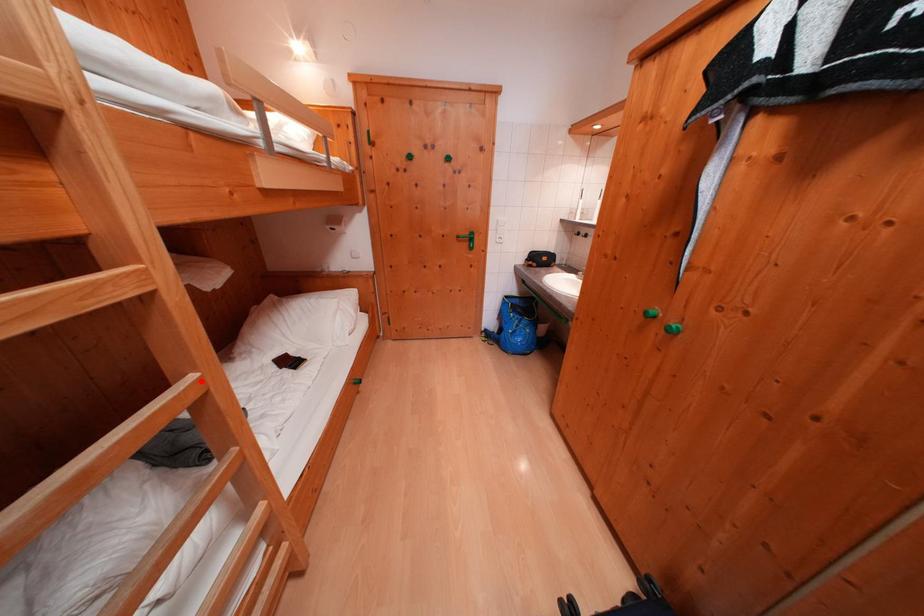
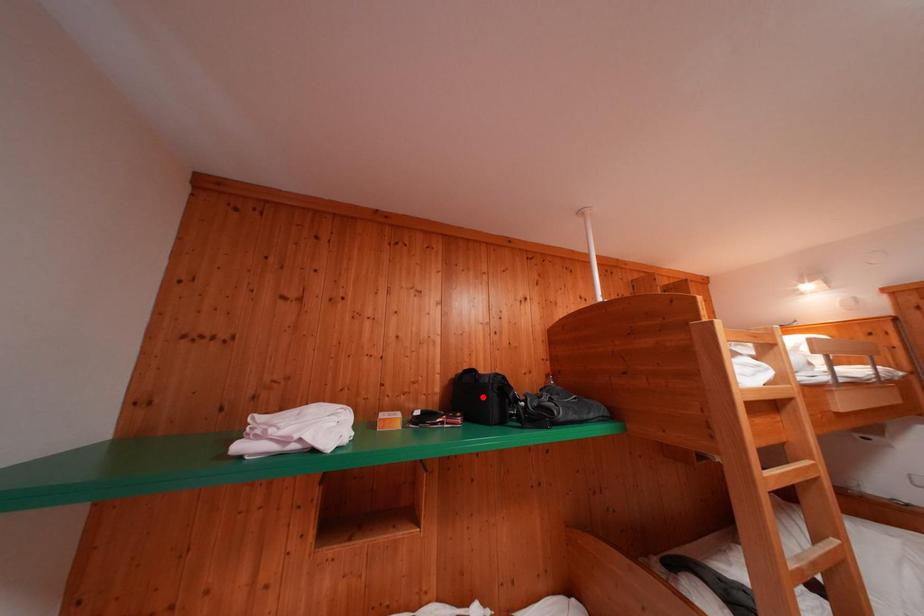
I am providing you with two images of the same scene from different viewpoints. A red point is marked on the first image and another point is marked on the second image. Do the highlighted points in image1 and image2 indicate the same real-world spot?

No